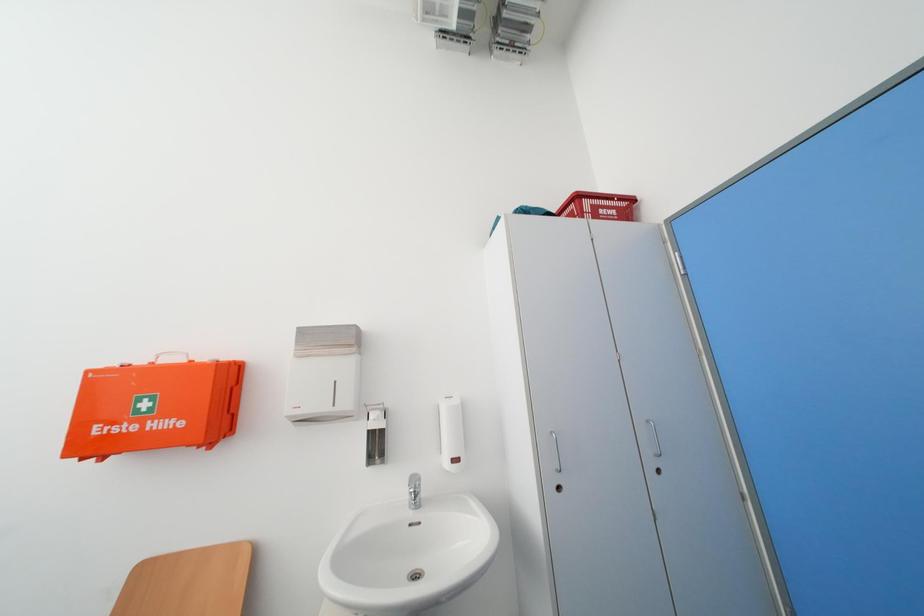
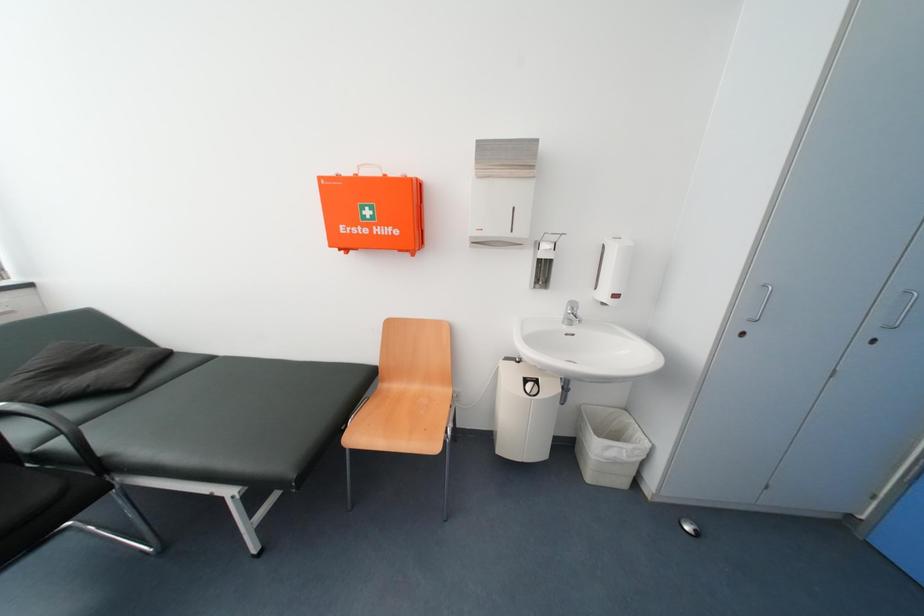
How did the camera likely rotate?

The camera rotated toward left-down.